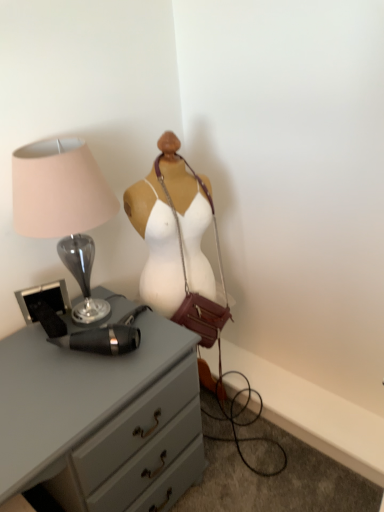
Question: Does matte glass lamp at left have a smaller size compared to matte gray chest of drawers at center-left?

Choices:
 (A) no
 (B) yes

Answer: (B)

Question: From the image's perspective, is matte glass lamp at left on top of matte gray chest of drawers at center-left?

Choices:
 (A) no
 (B) yes

Answer: (B)

Question: Does matte glass lamp at left have a greater width compared to matte gray chest of drawers at center-left?

Choices:
 (A) no
 (B) yes

Answer: (A)

Question: Considering the relative positions of matte glass lamp at left and matte gray chest of drawers at center-left in the image provided, is matte glass lamp at left to the right of matte gray chest of drawers at center-left from the viewer's perspective?

Choices:
 (A) yes
 (B) no

Answer: (B)

Question: Is matte glass lamp at left far away from matte gray chest of drawers at center-left?

Choices:
 (A) yes
 (B) no

Answer: (B)

Question: From a real-world perspective, is matte glass lamp at left over matte gray chest of drawers at center-left?

Choices:
 (A) yes
 (B) no

Answer: (A)

Question: From a real-world perspective, is matte glass lamp at left located higher than leather/maroon handbag at center?

Choices:
 (A) yes
 (B) no

Answer: (A)

Question: From the image's perspective, is matte glass lamp at left located beneath leather/maroon handbag at center?

Choices:
 (A) yes
 (B) no

Answer: (B)

Question: Can you confirm if matte glass lamp at left is wider than leather/maroon handbag at center?

Choices:
 (A) yes
 (B) no

Answer: (A)

Question: Is the depth of matte glass lamp at left less than that of leather/maroon handbag at center?

Choices:
 (A) no
 (B) yes

Answer: (B)

Question: Is matte glass lamp at left shorter than leather/maroon handbag at center?

Choices:
 (A) no
 (B) yes

Answer: (B)

Question: Considering the relative sizes of matte glass lamp at left and leather/maroon handbag at center in the image provided, is matte glass lamp at left bigger than leather/maroon handbag at center?

Choices:
 (A) yes
 (B) no

Answer: (A)

Question: Is the depth of matte gray chest of drawers at center-left less than that of leather/maroon handbag at center?

Choices:
 (A) yes
 (B) no

Answer: (A)